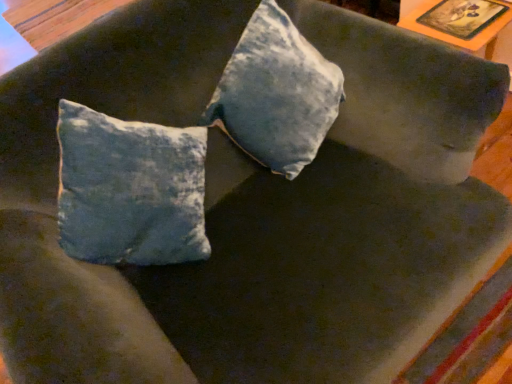
Image resolution: width=512 pixels, height=384 pixels. What do you see at coordinates (464, 17) in the screenshot? I see `wooden table at upper right` at bounding box center [464, 17].

You are a GUI agent. You are given a task and a screenshot of the screen. Output one action in this format:
    pyautogui.click(x=<x>, y=<y>)
    Task: Click on the wooden table at upper right
    This screenshot has height=384, width=512.
    Given the screenshot: What is the action you would take?
    pyautogui.click(x=464, y=17)

Where is `wooden table at upper right`? wooden table at upper right is located at coordinates (464, 17).